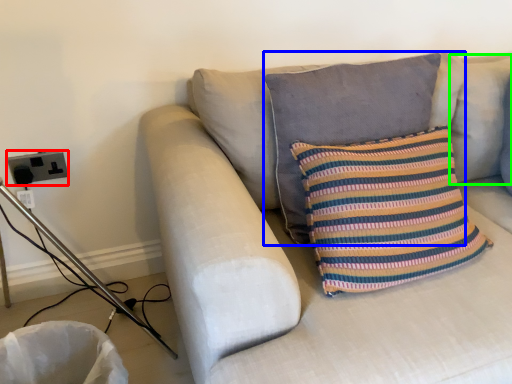
Question: Which object is positioned farthest from electric outlet (highlighted by a red box)? Select from pillow (highlighted by a blue box) and pillow (highlighted by a green box).

Choices:
 (A) pillow
 (B) pillow

Answer: (B)